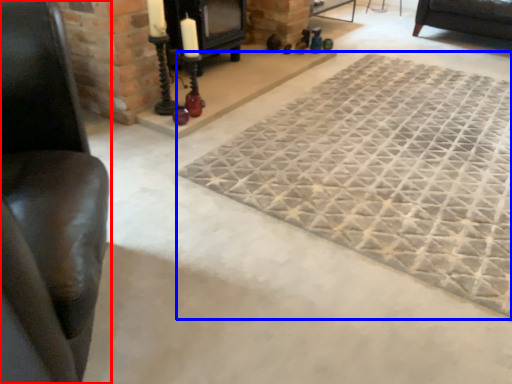
Question: Which object appears closest to the camera in this image, furniture (highlighted by a red box) or mat (highlighted by a blue box)?

Choices:
 (A) furniture
 (B) mat

Answer: (A)